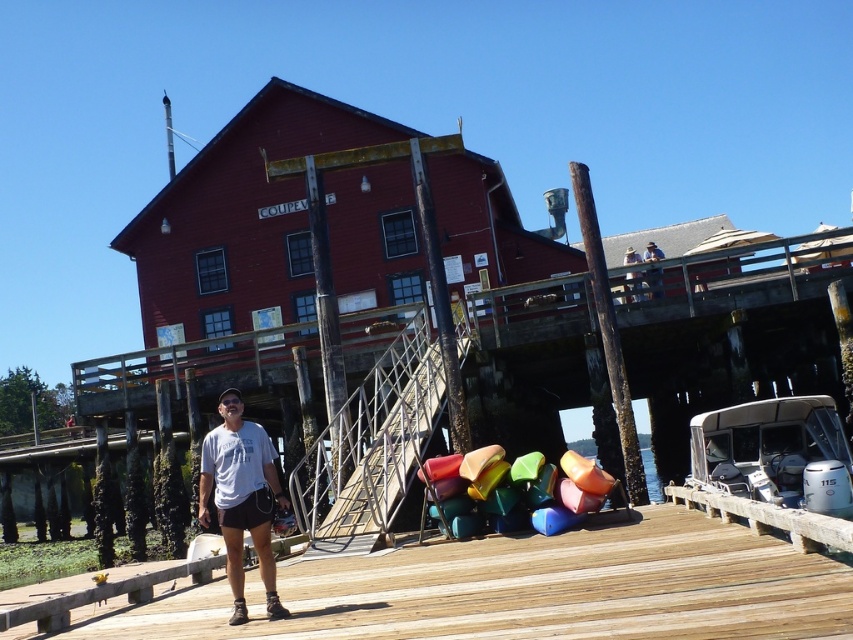
Question: Which of the following is the closest to the observer?

Choices:
 (A) light brown wooden bench at upper center
 (B) wooden at center

Answer: (B)

Question: Which point is farther to the camera?

Choices:
 (A) blue denim jeans at upper center
 (B) white glossy boat at lower right
 (C) white cotton t-shirt at center
 (D) shiny plastic kayaks at center

Answer: (A)

Question: Does white glossy boat at lower right have a greater width compared to white cotton t-shirt at center?

Choices:
 (A) no
 (B) yes

Answer: (B)

Question: Which point is closer to the camera?

Choices:
 (A) shiny plastic kayaks at center
 (B) transparent plastic water at lower center
 (C) blue denim jeans at upper center

Answer: (A)

Question: In this image, where is wooden at center located relative to blue denim jeans at upper center?

Choices:
 (A) left
 (B) right

Answer: (A)

Question: Does white glossy boat at lower right have a larger size compared to blue denim jeans at upper center?

Choices:
 (A) no
 (B) yes

Answer: (A)